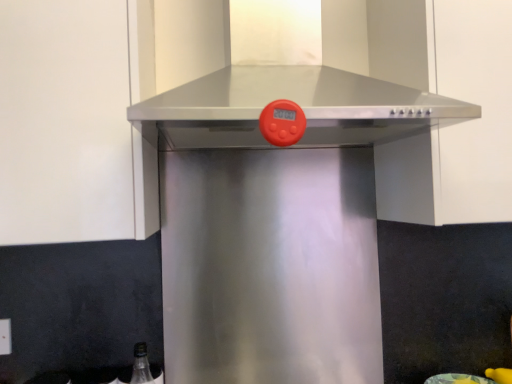
Question: Is stainless steel range hood at center thinner than stainless steel vent at center?

Choices:
 (A) no
 (B) yes

Answer: (B)

Question: Can you confirm if stainless steel range hood at center is positioned to the left of stainless steel vent at center?

Choices:
 (A) yes
 (B) no

Answer: (B)

Question: Considering the relative sizes of stainless steel range hood at center and stainless steel vent at center in the image provided, is stainless steel range hood at center wider than stainless steel vent at center?

Choices:
 (A) no
 (B) yes

Answer: (A)

Question: Does stainless steel range hood at center have a greater height compared to stainless steel vent at center?

Choices:
 (A) no
 (B) yes

Answer: (B)

Question: Does stainless steel range hood at center have a larger size compared to stainless steel vent at center?

Choices:
 (A) no
 (B) yes

Answer: (A)

Question: From a real-world perspective, is stainless steel range hood at center physically below stainless steel vent at center?

Choices:
 (A) no
 (B) yes

Answer: (B)

Question: From a real-world perspective, is stainless steel vent at center on top of stainless steel range hood at center?

Choices:
 (A) yes
 (B) no

Answer: (A)

Question: Is stainless steel range hood at center at the back of stainless steel vent at center?

Choices:
 (A) no
 (B) yes

Answer: (A)

Question: Is stainless steel vent at center next to stainless steel range hood at center?

Choices:
 (A) yes
 (B) no

Answer: (B)

Question: Is stainless steel vent at center shorter than stainless steel range hood at center?

Choices:
 (A) yes
 (B) no

Answer: (A)

Question: Is stainless steel vent at center at the left side of stainless steel range hood at center?

Choices:
 (A) yes
 (B) no

Answer: (A)

Question: Considering the relative sizes of stainless steel vent at center and stainless steel range hood at center in the image provided, is stainless steel vent at center smaller than stainless steel range hood at center?

Choices:
 (A) no
 (B) yes

Answer: (A)

Question: In the image, is stainless steel vent at center on the left side or the right side of stainless steel range hood at center?

Choices:
 (A) left
 (B) right

Answer: (A)